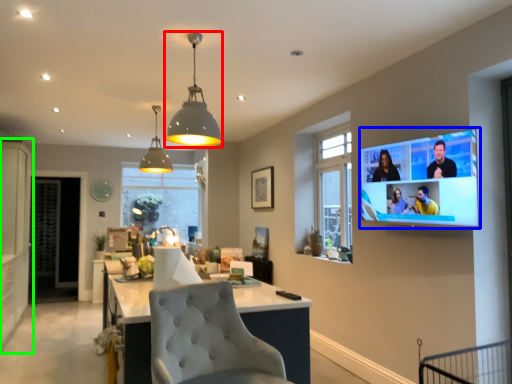
Question: Which is nearer to the light fixture (highlighted by a red box)? tv show (highlighted by a blue box) or cabinetry (highlighted by a green box).

Choices:
 (A) tv show
 (B) cabinetry

Answer: (A)